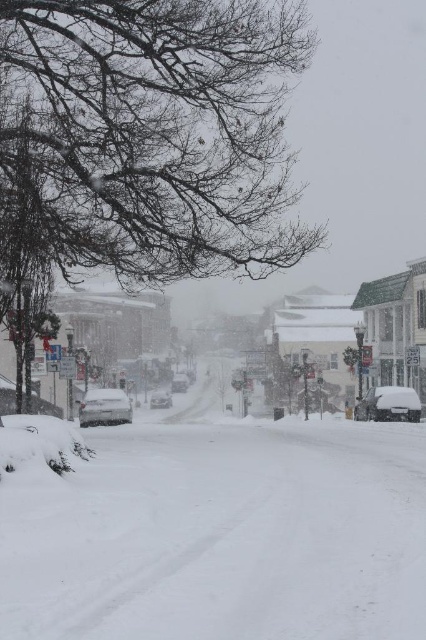
Question: Among these points, which one is nearest to the camera?

Choices:
 (A) (172, 387)
 (B) (57, 554)

Answer: (B)

Question: Among these objects, which one is farthest from the camera?

Choices:
 (A) white matte car at center
 (B) white powdery snow at center
 (C) white matte car at right

Answer: (A)

Question: Where is white snow-covered town at center located in relation to white matte car at right in the image?

Choices:
 (A) below
 (B) above

Answer: (B)

Question: Which of these objects is positioned farthest from the white snow-covered town at center?

Choices:
 (A) silver metallic sedan at center
 (B) white matte car at center
 (C) white matte car at right
 (D) white powdery snow at center

Answer: (D)

Question: Where is white matte car at right located in relation to white matte car at center in the image?

Choices:
 (A) below
 (B) above

Answer: (B)

Question: Can you confirm if white powdery snow at center is positioned above white matte car at center?

Choices:
 (A) yes
 (B) no

Answer: (A)